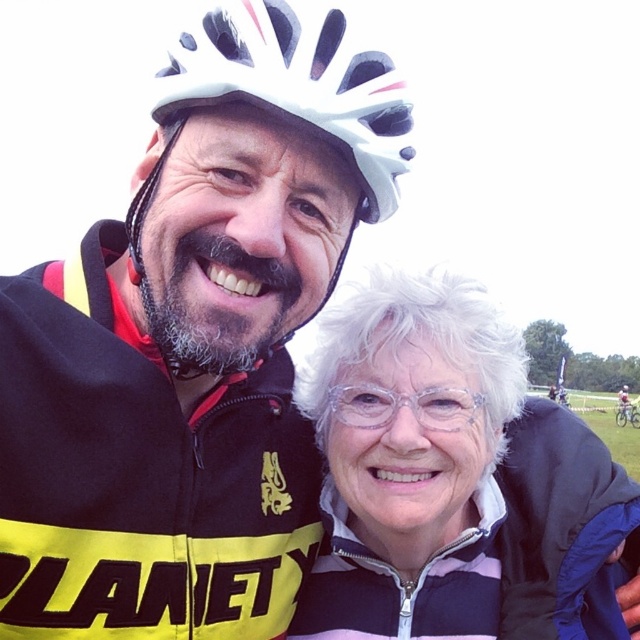
Between white matte bicycle helmet at upper center and clear plastic glasses at center, which one is positioned lower?

clear plastic glasses at center is below.

Can you confirm if white matte bicycle helmet at upper center is smaller than clear plastic glasses at center?

Actually, white matte bicycle helmet at upper center might be larger than clear plastic glasses at center.

Where is `white matte bicycle helmet at upper center`? The width and height of the screenshot is (640, 640). white matte bicycle helmet at upper center is located at coordinates [296, 84].

Is white textured hair at center below white matte bicycle helmet at upper center?

Yes.

Who is lower down, white textured hair at center or white matte bicycle helmet at upper center?

white textured hair at center is below.

Between point (369, 436) and point (323, 45), which one is positioned in front?

Point (323, 45) is in front.

Find the location of `white textured hair at center`. white textured hair at center is located at coordinates click(x=456, y=481).

Can you confirm if white textured hair at center is smaller than clear plastic glasses at center?

Actually, white textured hair at center might be larger than clear plastic glasses at center.

Does point (333, 470) come in front of point (364, 426)?

No, it is not.

Locate an element on the screen. The width and height of the screenshot is (640, 640). white textured hair at center is located at coordinates (456, 481).

In order to click on white textured hair at center in this screenshot , I will do `click(456, 481)`.